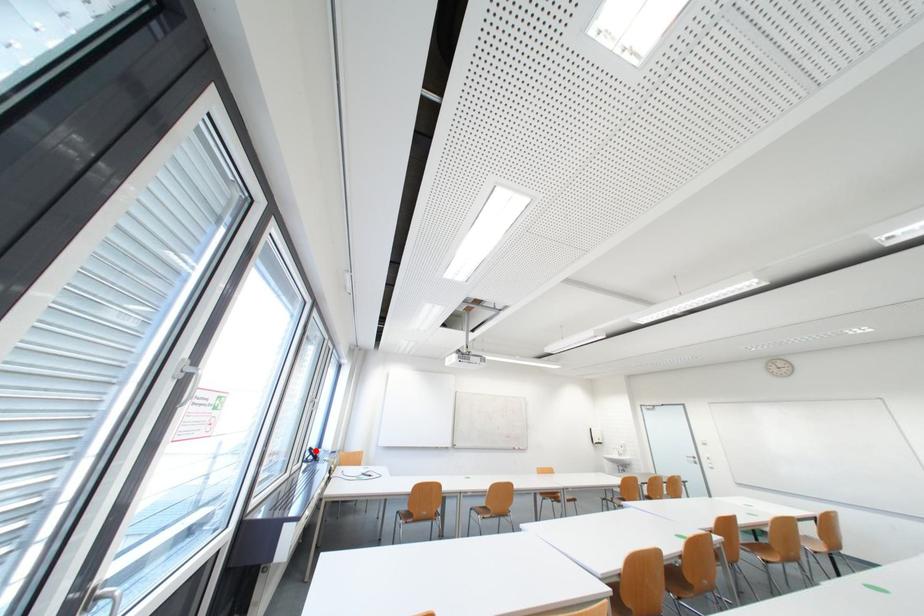
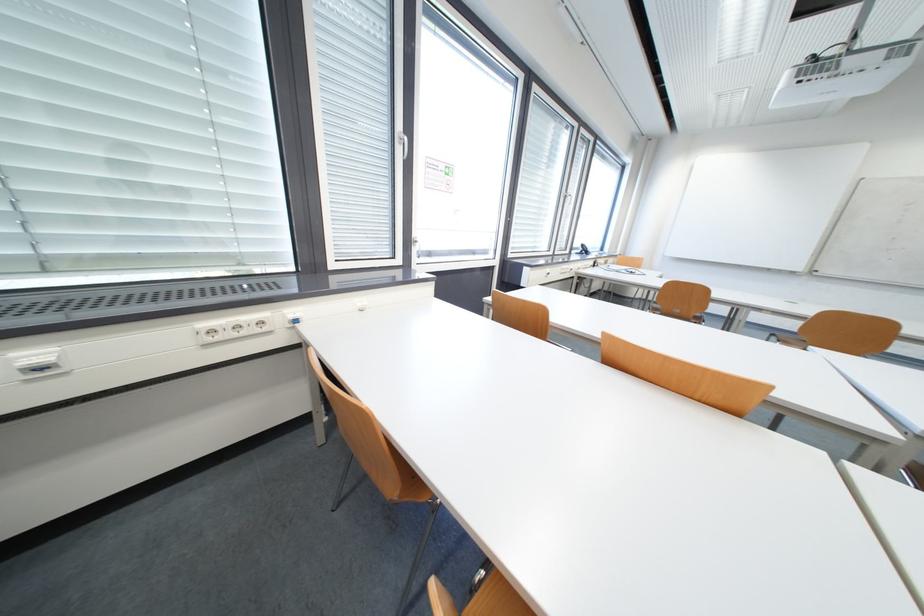
Question: I am providing you with two images of the same scene from different viewpoints. Given a red point in image1, look at the same physical point in image2. Is it:

Choices:
 (A) Closer to the viewpoint
 (B) Farther from the viewpoint

Answer: (A)